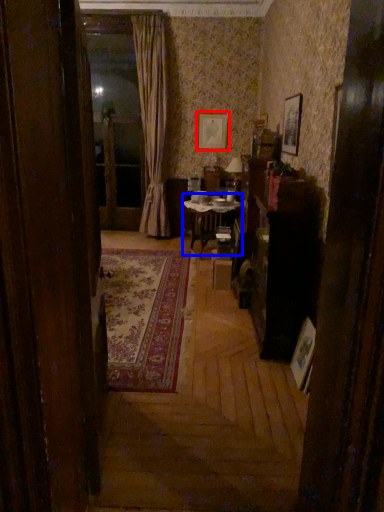
Question: Which object appears farthest to the camera in this image, picture frame (highlighted by a red box) or table (highlighted by a blue box)?

Choices:
 (A) picture frame
 (B) table

Answer: (A)